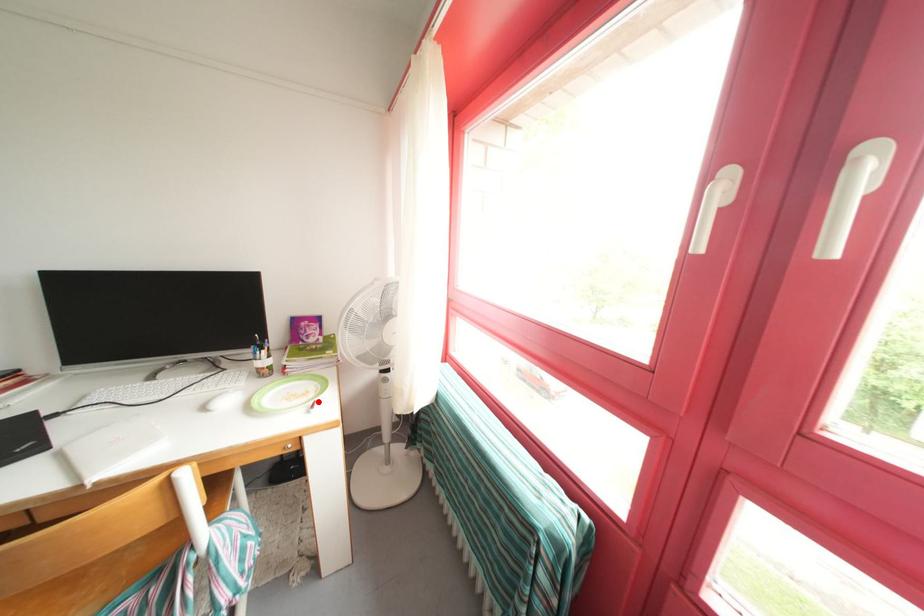
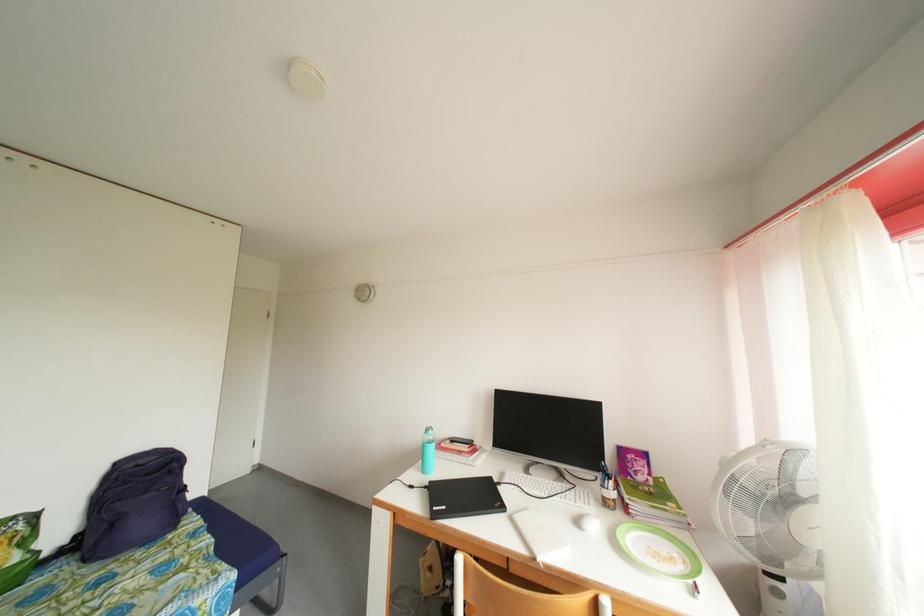
Where in the second image is the point corresponding to the highlighted location from the first image?

(688, 573)